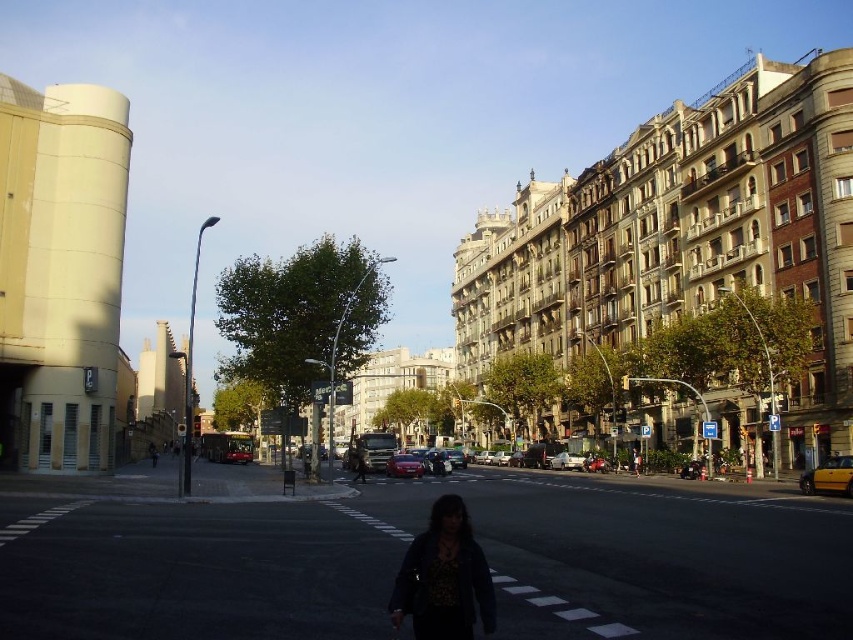
You are a pedestrian standing on the sidewalk and see the yellow matte taxi at lower right and the shiny red car at center. Which vehicle is nearer to you?

The yellow matte taxi at lower right is closer to the viewer than the shiny red car at center.

You are standing at the dark blue textured jacket at center in the urban street scene. You want to take a photo of the camera that is 33.39 meters away. Considering the lighting conditions of the scene, will you need a tripod to stabilize the shot?

The camera is 33.39 meters away from the dark blue textured jacket at center. Given the late afternoon or early evening lighting with long shadows, using a tripod would help stabilize the shot to avoid blur from camera shake, especially at such a distance.